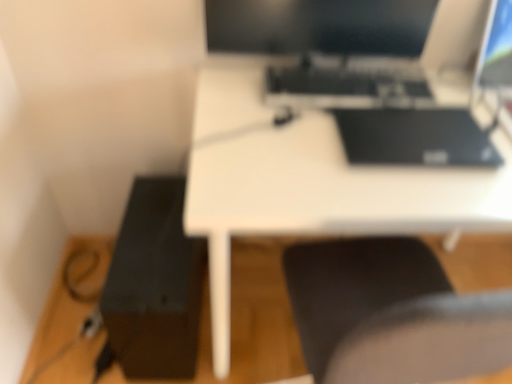
The width and height of the screenshot is (512, 384). What are the coordinates of `vacant space in front of black glossy monitor at upper center` in the screenshot? It's located at (303, 158).